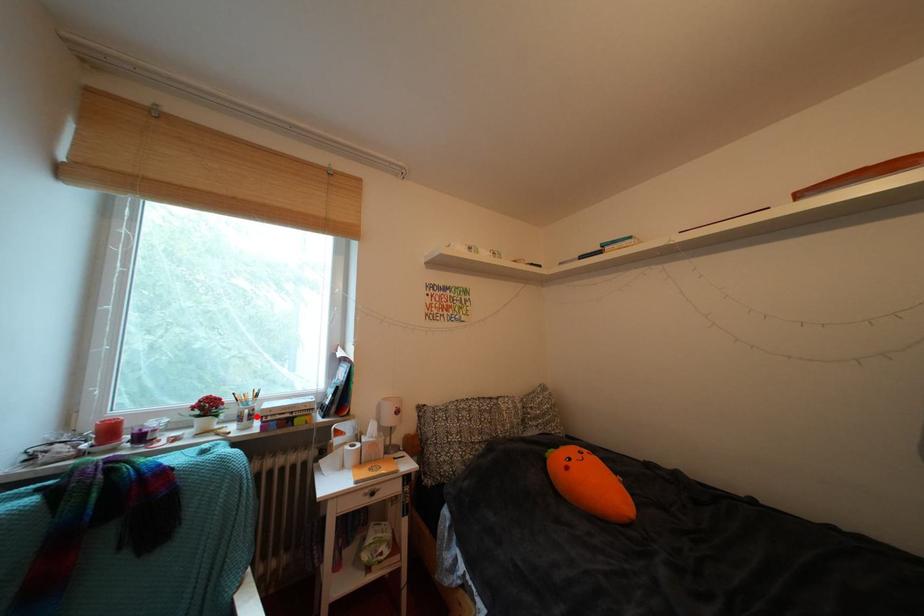
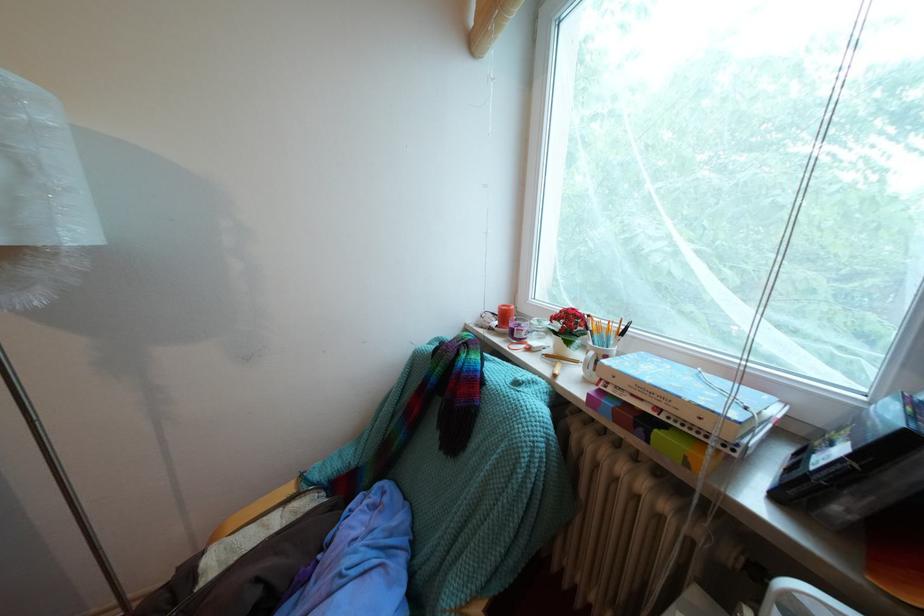
Where in the second image is the point corresponding to the highlighted location from the first image?

(602, 359)